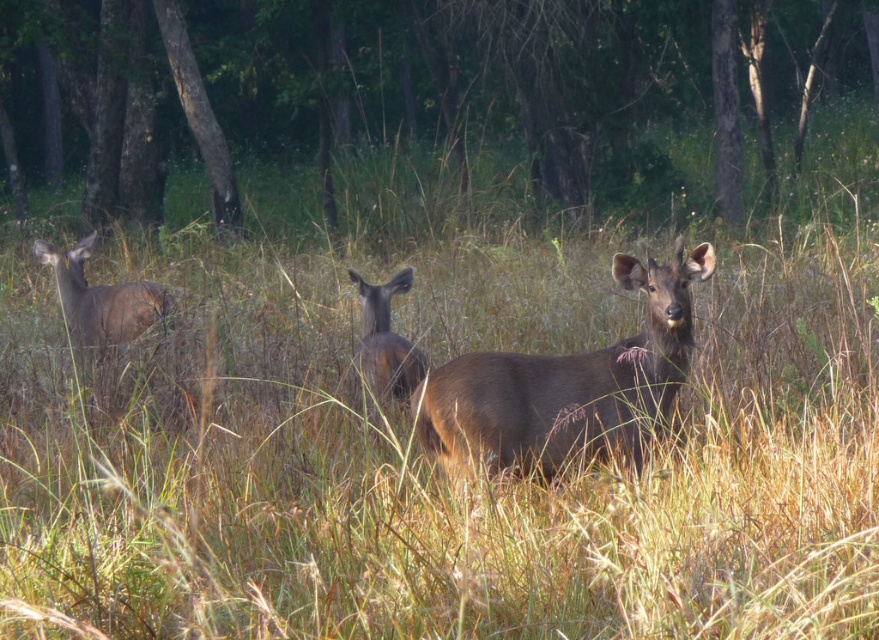
Between brown matte deer at left and brown matte/deer at center, which one appears on the left side from the viewer's perspective?

brown matte deer at left

This screenshot has width=879, height=640. Describe the element at coordinates (103, 300) in the screenshot. I see `brown matte deer at left` at that location.

You are a GUI agent. You are given a task and a screenshot of the screen. Output one action in this format:
    pyautogui.click(x=<x>, y=<y>)
    Task: Click on the brown matte deer at left
    This screenshot has width=879, height=640.
    Given the screenshot: What is the action you would take?
    pyautogui.click(x=103, y=300)

Is point (603, 166) more distant than point (471, 419)?

That is True.

Is point (565, 45) positioned before point (648, 291)?

That is False.

This screenshot has width=879, height=640. In order to click on green grass at center in this screenshot , I will do `click(413, 84)`.

The height and width of the screenshot is (640, 879). In order to click on green grass at center in this screenshot , I will do `click(413, 84)`.

Can you confirm if brown matte deer at center is smaller than brown matte/deer at center?

Correct, brown matte deer at center occupies less space than brown matte/deer at center.

Can you confirm if brown matte deer at center is bigger than brown matte/deer at center?

No.

Who is more forward, (440, 392) or (379, 368)?

A: Point (440, 392) is in front.

Locate an element on the screen. The image size is (879, 640). brown matte deer at center is located at coordinates (567, 385).